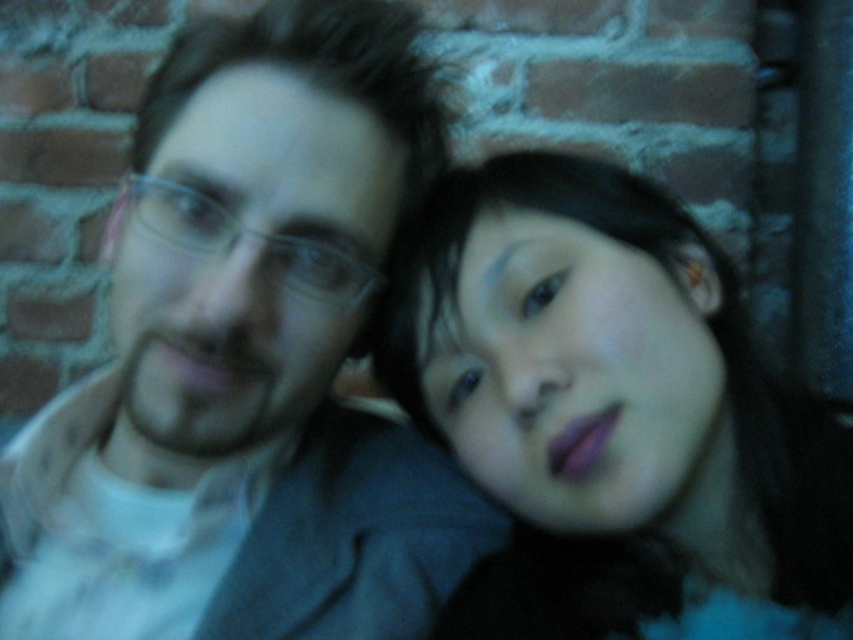
Question: Which object is closer to the camera taking this photo?

Choices:
 (A) matte white shirt at center
 (B) clear plastic glasses at center

Answer: (A)

Question: Which of the following is the closest to the observer?

Choices:
 (A) matte white shirt at center
 (B) matte black hair at center

Answer: (A)

Question: Is matte white shirt at center below clear plastic glasses at center?

Choices:
 (A) no
 (B) yes

Answer: (B)

Question: Which object appears farthest from the camera in this image?

Choices:
 (A) clear plastic glasses at center
 (B) matte white shirt at center

Answer: (A)

Question: Is matte black hair at center to the right of clear plastic glasses at center from the viewer's perspective?

Choices:
 (A) yes
 (B) no

Answer: (A)

Question: Does matte black hair at center appear on the left side of clear plastic glasses at center?

Choices:
 (A) no
 (B) yes

Answer: (A)